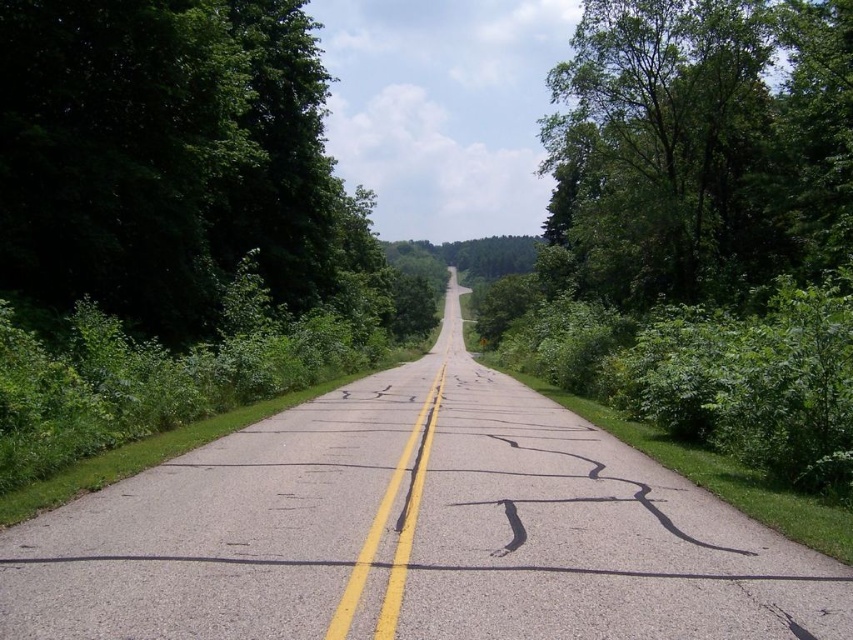
You are driving along the two lane road and see the green leafy tree at left and the green leafy tree at upper right. Which tree is taller?

The green leafy tree at upper right is taller than the green leafy tree at left.

You are a hiker who wants to cross the road safely. There are two green leafy trees, one at the left and one at the upper right. The road has a double yellow line and visible cracks. What is the shortest distance you need to walk to go from the green leafy tree at left to the green leafy tree at upper right?

The shortest distance between the green leafy tree at left and the green leafy tree at upper right is 17.18 meters.

You are standing at the center of the road and looking towards the direction of the road. Where is the green leafy tree at left located relative to your position?

The green leafy tree at left is located to the left side of the road, positioned at coordinates approximately 0.250 on the x and 0.199 on the y axis relative to the center of the road.